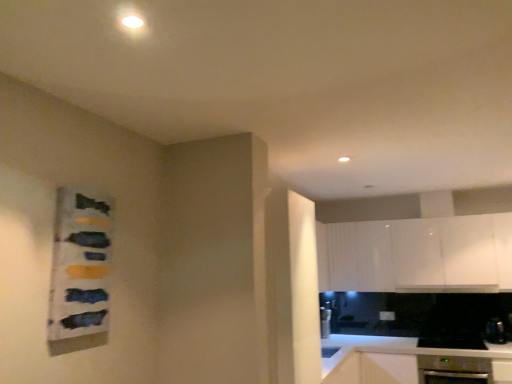
Question: Is white glossy cabinet at upper right inside the boundaries of satin black oven at lower right, which ranks as the second appliance in left-to-right order, or outside?

Choices:
 (A) outside
 (B) inside

Answer: (A)

Question: Considering the positions of point (391, 268) and point (496, 322), is point (391, 268) closer or farther from the camera than point (496, 322)?

Choices:
 (A) closer
 (B) farther

Answer: (B)

Question: Estimate the real-world distances between objects in this image. Which object is farther from the white glossy countertop at lower right?

Choices:
 (A) black stainless steel oven at lower right, which is the 2th appliance in right-to-left order
 (B) satin black oven at lower right, the 1th appliance in the right-to-left sequence
 (C) white glossy cabinet at upper right
 (D) satin silver dishwasher at lower right

Answer: (B)

Question: Considering the real-world distances, which object is farthest from the white glossy cabinet at upper right?

Choices:
 (A) white glossy countertop at lower right
 (B) black stainless steel oven at lower right, which is the 2th appliance in right-to-left order
 (C) satin black oven at lower right, the 1th appliance in the right-to-left sequence
 (D) satin silver dishwasher at lower right

Answer: (C)